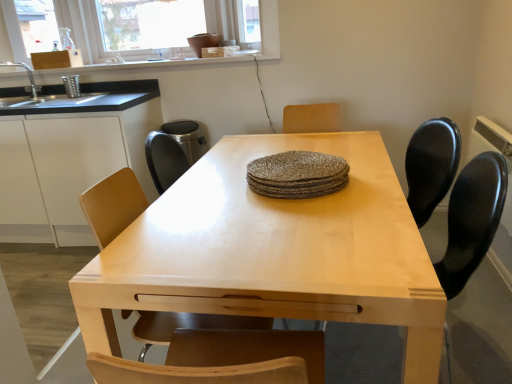
I want to click on light wood table at center, so click(256, 242).

The width and height of the screenshot is (512, 384). Find the location of `black granite countertop at left`. black granite countertop at left is located at coordinates (79, 98).

The width and height of the screenshot is (512, 384). Identify the location of black plastic swivel chair at right. (468, 224).

Does black plastic swivel chair at right have a lesser width compared to white matte cabinet at left?

Indeed, black plastic swivel chair at right has a lesser width compared to white matte cabinet at left.

Is black plastic swivel chair at right at the right side of white matte cabinet at left?

Yes, black plastic swivel chair at right is to the right of white matte cabinet at left.

Is black plastic swivel chair at right far away from white matte cabinet at left?

Yes, black plastic swivel chair at right is far from white matte cabinet at left.

Can you tell me how much light wood chair at center and black plastic swivel chair at right differ in facing direction?

There is a 178-degree angle between the facing directions of light wood chair at center and black plastic swivel chair at right.

Does point (236, 319) lie in front of point (475, 351)?

Yes, it is in front of point (475, 351).

From the picture: Considering the relative positions of light wood chair at center and black plastic swivel chair at right in the image provided, is light wood chair at center in front of black plastic swivel chair at right?

That is True.

Is light wood chair at center not close to black plastic swivel chair at right?

Yes, light wood chair at center is far from black plastic swivel chair at right.

Considering the relative sizes of transparent glass window screen at upper center and light wood chair at center in the image provided, is transparent glass window screen at upper center shorter than light wood chair at center?

Indeed, transparent glass window screen at upper center has a lesser height compared to light wood chair at center.

Which is in front, point (123, 39) or point (211, 321)?

The point (211, 321) is closer to the camera.

Is light wood chair at center at the back of transparent glass window screen at upper center?

Result: No, transparent glass window screen at upper center is not facing away from light wood chair at center.

From the image's perspective, which one is positioned higher, black plastic swivel chair at right or light wood chair at center?

black plastic swivel chair at right is shown above in the image.

Which point is more forward, (489, 205) or (123, 171)?

Positioned in front is point (489, 205).

Considering the sizes of objects black plastic swivel chair at right and light wood chair at center in the image provided, who is taller, black plastic swivel chair at right or light wood chair at center?

black plastic swivel chair at right is taller.

Is light wood chair at center taller than black granite countertop at left?

Yes.

What's the angular difference between light wood chair at center and black granite countertop at left's facing directions?

88.5 degrees.

The height and width of the screenshot is (384, 512). In order to click on countertop located behind the light wood chair at center in this screenshot , I will do `click(79, 98)`.

Which is less distant, (114, 205) or (15, 105)?

Point (114, 205) is positioned closer to the camera compared to point (15, 105).

This screenshot has width=512, height=384. I want to click on swivel chair below the transparent glass window screen at upper center (from a real-world perspective), so click(x=468, y=224).

Between black plastic swivel chair at right and transparent glass window screen at upper center, which one is positioned in front?

black plastic swivel chair at right is closer to the camera.

Is black plastic swivel chair at right not close to transparent glass window screen at upper center?

Yes, black plastic swivel chair at right and transparent glass window screen at upper center are quite far apart.

From a real-world perspective, which is physically below, black granite countertop at left or white matte cabinet at left?

white matte cabinet at left is physically lower.

Does black granite countertop at left appear on the left side of white matte cabinet at left?

Incorrect, black granite countertop at left is not on the left side of white matte cabinet at left.

Is black granite countertop at left positioned beyond the bounds of white matte cabinet at left?

Yes, black granite countertop at left is outside of white matte cabinet at left.

At what (x,y) coordinates should I click in order to perform the action: click on cabinetry above the black plastic swivel chair at right (from the image's perspective). Please return your answer as a coordinate pair (x, y). Image resolution: width=512 pixels, height=384 pixels. Looking at the image, I should click on (70, 156).

At what (x,y) coordinates should I click in order to perform the action: click on chair below the black plastic swivel chair at right (from the image's perspective). Please return your answer as a coordinate pair (x, y). The image size is (512, 384). Looking at the image, I should click on (113, 205).

When comparing their distances from black plastic swivel chair at right, does white matte cabinet at left or light wood chair at center seem further?

white matte cabinet at left is positioned further to the anchor black plastic swivel chair at right.

Estimate the real-world distances between objects in this image. Which object is further from black granite countertop at left, light wood chair at center or black plastic swivel chair at right?

Among the two, black plastic swivel chair at right is located further to black granite countertop at left.

When comparing their distances from white matte cabinet at left, does black plastic swivel chair at right or light wood chair at center seem closer?

Among the two, light wood chair at center is located nearer to white matte cabinet at left.

Looking at the image, which one is located closer to black granite countertop at left, white matte cabinet at left or black plastic swivel chair at right?

Based on the image, white matte cabinet at left appears to be nearer to black granite countertop at left.

Looking at the image, which one is located further to light wood chair at center, light wood table at center or transparent glass window screen at upper center?

The object further to light wood chair at center is transparent glass window screen at upper center.

In the scene shown: Considering their positions, is black granite countertop at left positioned further to white matte cabinet at left than transparent glass window screen at upper center?

transparent glass window screen at upper center.

Based on their spatial positions, is black plastic swivel chair at right or black granite countertop at left further from light wood chair at center?

black granite countertop at left is positioned further to the anchor light wood chair at center.

When comparing their distances from white matte cabinet at left, does light wood chair at center or black plastic swivel chair at right seem further?

black plastic swivel chair at right is further to white matte cabinet at left.

The height and width of the screenshot is (384, 512). I want to click on table situated between light wood chair at center and black plastic swivel chair at right from left to right, so click(x=256, y=242).

Where is `chair between light wood table at center and transparent glass window screen at upper center along the z-axis`? This screenshot has height=384, width=512. chair between light wood table at center and transparent glass window screen at upper center along the z-axis is located at coordinates (113, 205).

Where is `swivel chair located between light wood chair at center and transparent glass window screen at upper center in the depth direction`? Image resolution: width=512 pixels, height=384 pixels. swivel chair located between light wood chair at center and transparent glass window screen at upper center in the depth direction is located at coordinates (468, 224).

At what (x,y) coordinates should I click in order to perform the action: click on cabinetry between light wood chair at center and black granite countertop at left along the z-axis. Please return your answer as a coordinate pair (x, y). This screenshot has width=512, height=384. Looking at the image, I should click on (70, 156).